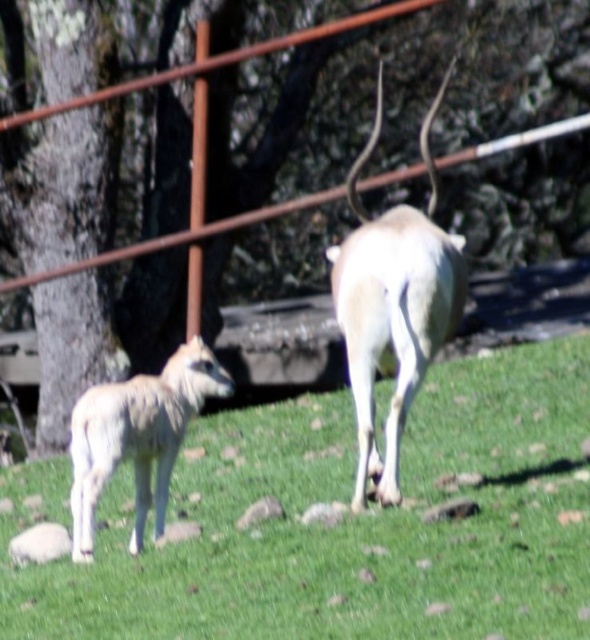
You are a photographer trying to capture a clear photo of the white smooth horned deer at center. However, the green grass at center is blocking your view. Can you adjust your camera angle to see the deer without the grass blocking it?

The green grass at center is below the white smooth horned deer at center, so you can adjust your camera angle upwards to see the deer without the grass blocking it.

You are a wildlife photographer trying to capture a photo of both the white smooth horned deer at center and the white woolen lamb at lower left. Which animal should you focus on first if you want to include both in your shot without zooming in or out?

The white smooth horned deer at center has a lesser width compared to the white woolen lamb at lower left. Since the deer is smaller in width, you should focus on the white woolen lamb at lower left first to ensure both fit in the frame without zooming.

You are standing at the edge of the grassy area and want to place a small water bowl for the antelopes. According to the image, where should you place it so that it is exactly at the center of the green grass at center?

The green grass at center is located at point (340, 522), so you should place the water bowl exactly at those coordinates to ensure it is at the center of the green grass at center.